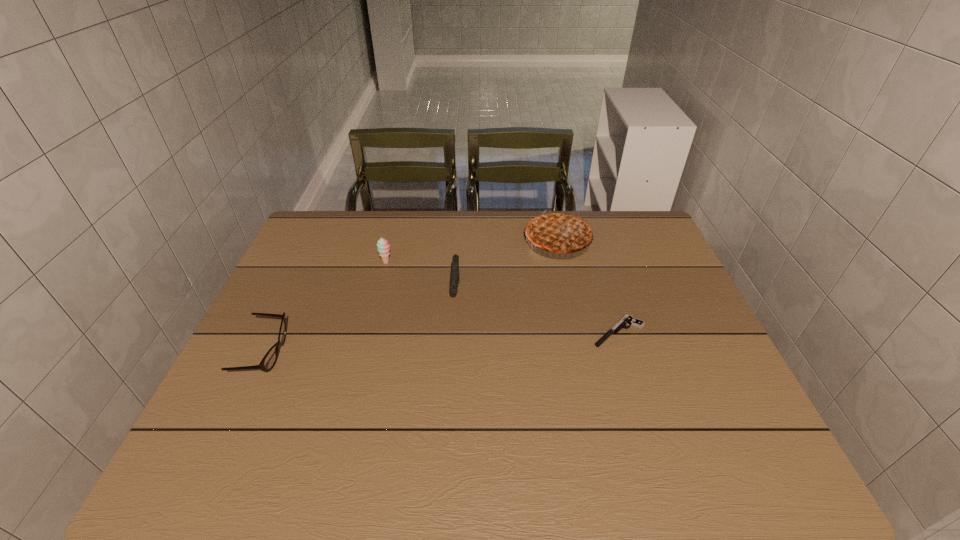
Identify the location of vacant space at the left edge of the desktop. The height and width of the screenshot is (540, 960). (318, 320).

The width and height of the screenshot is (960, 540). I want to click on vacant space at the right edge of the desktop, so (x=721, y=390).

This screenshot has height=540, width=960. I want to click on vacant area at the far right corner, so click(632, 225).

Where is `free space between the third object from right to left and the spectacles`? Image resolution: width=960 pixels, height=540 pixels. free space between the third object from right to left and the spectacles is located at coordinates coord(360,323).

The height and width of the screenshot is (540, 960). I want to click on vacant space that is in between the shorter pistol and the fourth object from right to left, so click(503, 297).

At what (x,y) coordinates should I click in order to perform the action: click on vacant area that lies between the leftmost object and the right pistol. Please return your answer as a coordinate pair (x, y). The height and width of the screenshot is (540, 960). Looking at the image, I should click on (442, 342).

This screenshot has height=540, width=960. Find the location of `vacant space in between the spectacles and the nearer pistol`. vacant space in between the spectacles and the nearer pistol is located at coordinates (442, 342).

The image size is (960, 540). What are the coordinates of `blank region between the fourth object from right to left and the third nearest object` in the screenshot? It's located at (421, 278).

Where is `free space that is in between the taller pistol and the tallest object`? free space that is in between the taller pistol and the tallest object is located at coordinates (507, 266).

Image resolution: width=960 pixels, height=540 pixels. I want to click on vacant point located between the leftmost object and the sherbert, so click(325, 308).